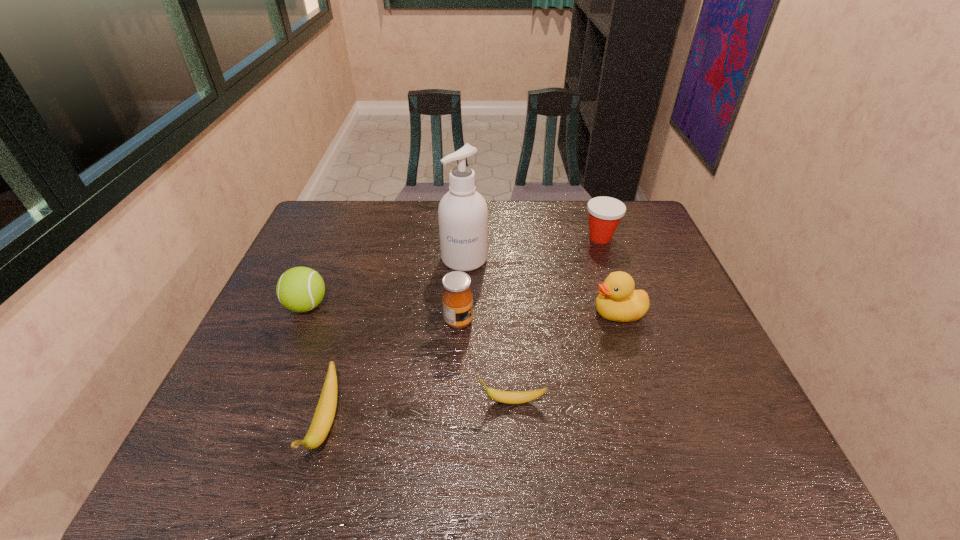
You are a GUI agent. You are given a task and a screenshot of the screen. Output one action in this format:
    pyautogui.click(x=<x>, y=<y>)
    Task: Click on the free point that keeps the bananas evenly spaced on the right
    
    Given the screenshot: What is the action you would take?
    pyautogui.click(x=683, y=381)